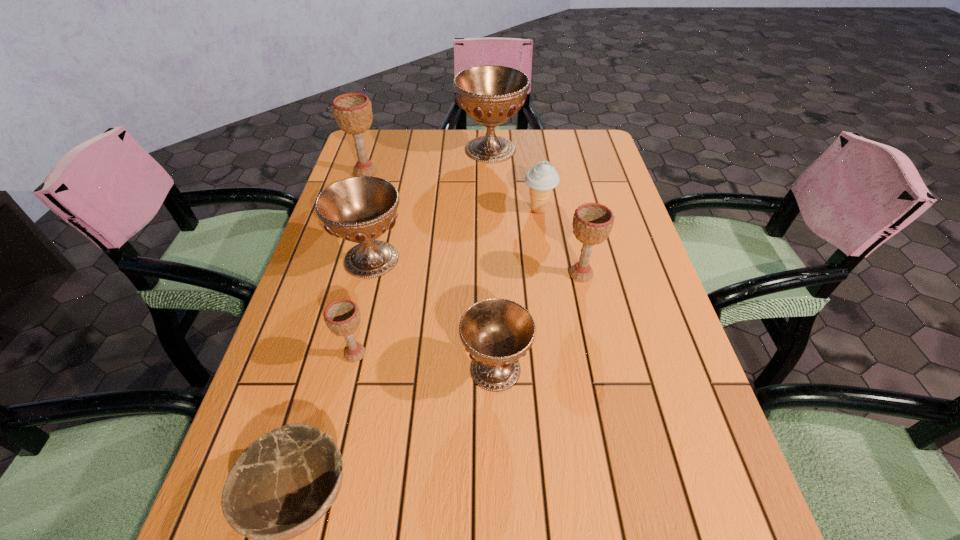
Identify the location of the nearest beige chalice. (342, 317).

Find the location of a particular element. the nearest red chalice is located at coordinates (497, 332).

Image resolution: width=960 pixels, height=540 pixels. Find the location of `free space located 0.160m on the left of the biggest red chalice`. free space located 0.160m on the left of the biggest red chalice is located at coordinates (407, 149).

Locate an element on the screen. The width and height of the screenshot is (960, 540). free region located 0.190m on the front of the biggest beige chalice is located at coordinates (349, 223).

This screenshot has height=540, width=960. What are the coordinates of `free space located on the front of the second smallest red chalice` in the screenshot? It's located at (338, 396).

The width and height of the screenshot is (960, 540). I want to click on vacant space situated 0.400m on the left of the rightmost chalice, so click(393, 274).

Locate an element on the screen. This screenshot has width=960, height=540. free space located on the left of the sixth nearest object is located at coordinates (402, 210).

Where is `vacant space located on the back of the second beige chalice from left to right`? This screenshot has height=540, width=960. vacant space located on the back of the second beige chalice from left to right is located at coordinates (380, 246).

Find the location of a particular element. The width and height of the screenshot is (960, 540). vacant region located on the right of the smallest red chalice is located at coordinates (622, 369).

The image size is (960, 540). I want to click on object present at the right edge, so click(x=592, y=222).